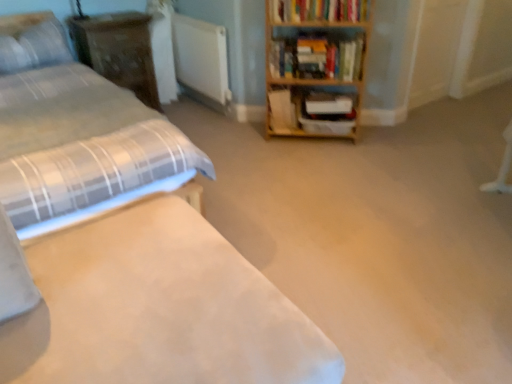
Question: Does wooden shelf at center appear on the left side of hardcover book at upper right, which is the third book in bottom-to-top order?

Choices:
 (A) no
 (B) yes

Answer: (A)

Question: Can you confirm if wooden shelf at center is taller than hardcover book at upper right, which ranks as the 1th book in top-to-bottom order?

Choices:
 (A) yes
 (B) no

Answer: (A)

Question: Does wooden shelf at center have a lesser height compared to hardcover book at upper right, which ranks as the 1th book in top-to-bottom order?

Choices:
 (A) yes
 (B) no

Answer: (B)

Question: Does wooden shelf at center have a greater width compared to hardcover book at upper right, which is the third book in bottom-to-top order?

Choices:
 (A) yes
 (B) no

Answer: (A)

Question: Can you confirm if wooden shelf at center is positioned to the right of hardcover book at upper right, which ranks as the 1th book in top-to-bottom order?

Choices:
 (A) yes
 (B) no

Answer: (A)

Question: Considering the relative positions of wooden shelf at center and wooden dresser at upper left in the image provided, is wooden shelf at center to the left or to the right of wooden dresser at upper left?

Choices:
 (A) left
 (B) right

Answer: (B)

Question: In the image, is wooden shelf at center positioned in front of or behind wooden dresser at upper left?

Choices:
 (A) behind
 (B) front

Answer: (B)

Question: From a real-world perspective, is wooden shelf at center physically located above or below wooden dresser at upper left?

Choices:
 (A) below
 (B) above

Answer: (A)

Question: From the image's perspective, relative to wooden dresser at upper left, is wooden shelf at center above or below?

Choices:
 (A) above
 (B) below

Answer: (B)

Question: Considering their positions, is hardcover book at upper right, which ranks as the 1th book in top-to-bottom order, located in front of or behind wooden bookcase at upper right?

Choices:
 (A) front
 (B) behind

Answer: (B)

Question: Looking at the image, does hardcover book at upper right, which ranks as the 1th book in top-to-bottom order, seem bigger or smaller compared to wooden bookcase at upper right?

Choices:
 (A) big
 (B) small

Answer: (B)

Question: Based on their positions, is hardcover book at upper right, which is the third book in bottom-to-top order, located to the left or right of wooden bookcase at upper right?

Choices:
 (A) right
 (B) left

Answer: (A)

Question: From a real-world perspective, relative to wooden bookcase at upper right, is hardcover book at upper right, which is the third book in bottom-to-top order, vertically above or below?

Choices:
 (A) below
 (B) above

Answer: (B)

Question: Is wooden bookshelf at center, which is the first book from bottom to top, wider or thinner than white fabric bed at left, the 2th bed from the back?

Choices:
 (A) wide
 (B) thin

Answer: (B)

Question: From their relative heights in the image, would you say wooden bookshelf at center, which is the third book from top to bottom, is taller or shorter than white fabric bed at left, the 2th bed from the back?

Choices:
 (A) tall
 (B) short

Answer: (B)